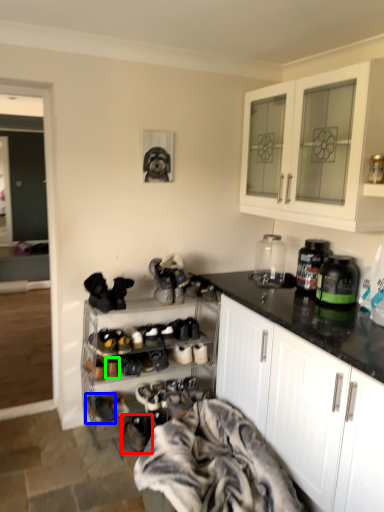
Question: Estimate the real-world distances between objects in this image. Which object is closer to footwear (highlighted by a red box), footwear (highlighted by a blue box) or shoe (highlighted by a green box)?

Choices:
 (A) footwear
 (B) shoe

Answer: (A)